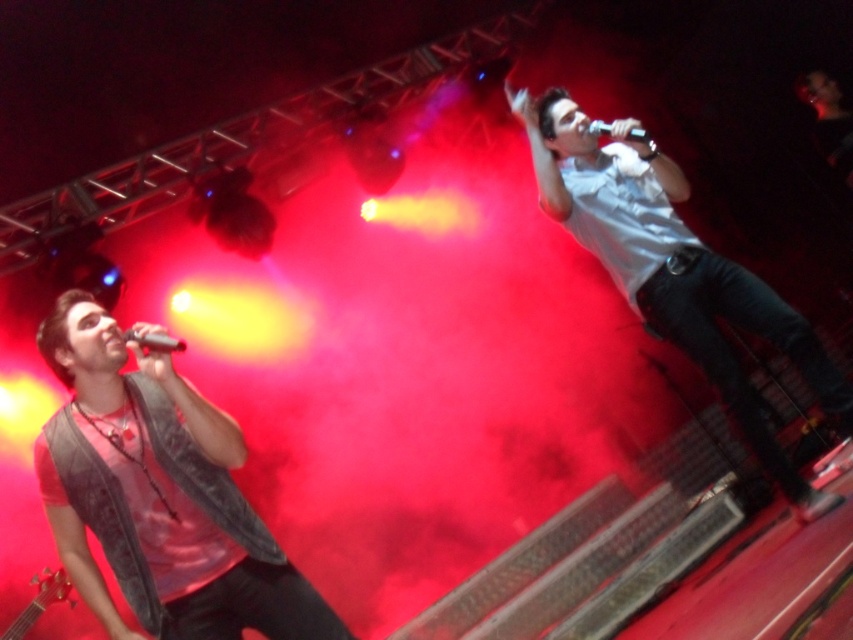
You are a stagehand needing to place a new microphone stand between the denim vest at left and the metallic silver microphone at upper center. Based on their widths, can you determine if there is enough space for the stand?

The denim vest at left might be wider than metallic silver microphone at upper center, so there may not be enough space for the stand between them.

Based on the coordinates provided, which object from the scene is located at point (674,269)?

The white matte shirt at upper right is located at point (674,269).